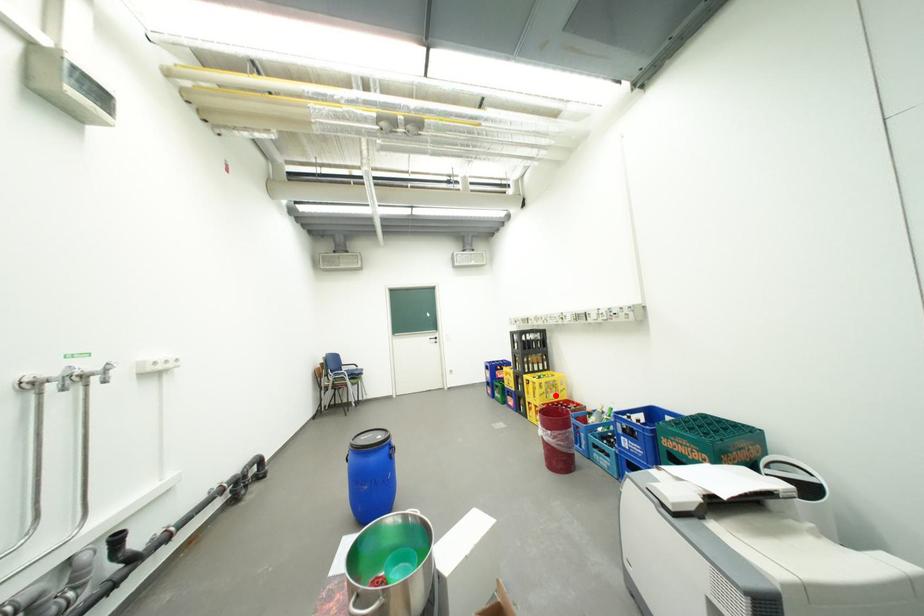
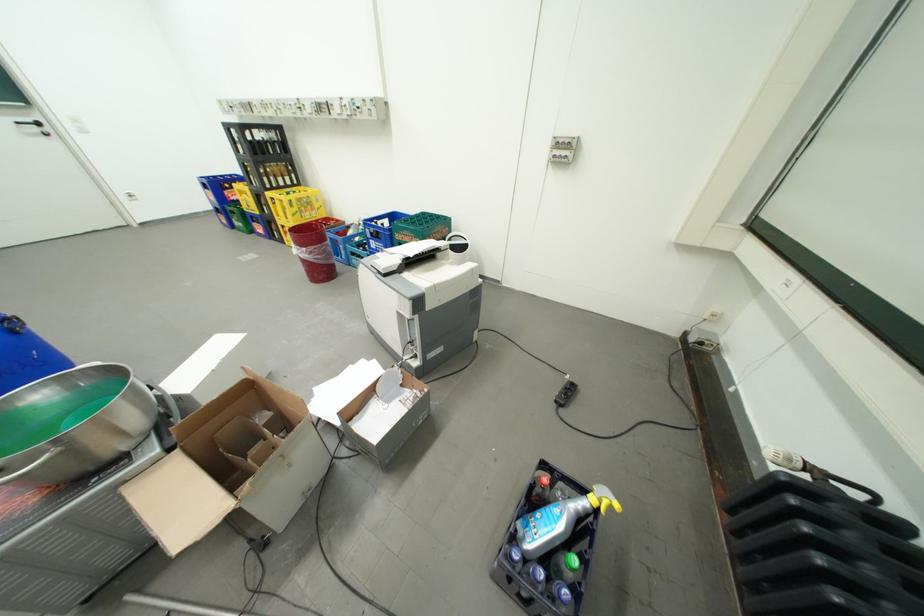
Find the pixel in the second image that matches the highlighted location in the first image.

(310, 215)